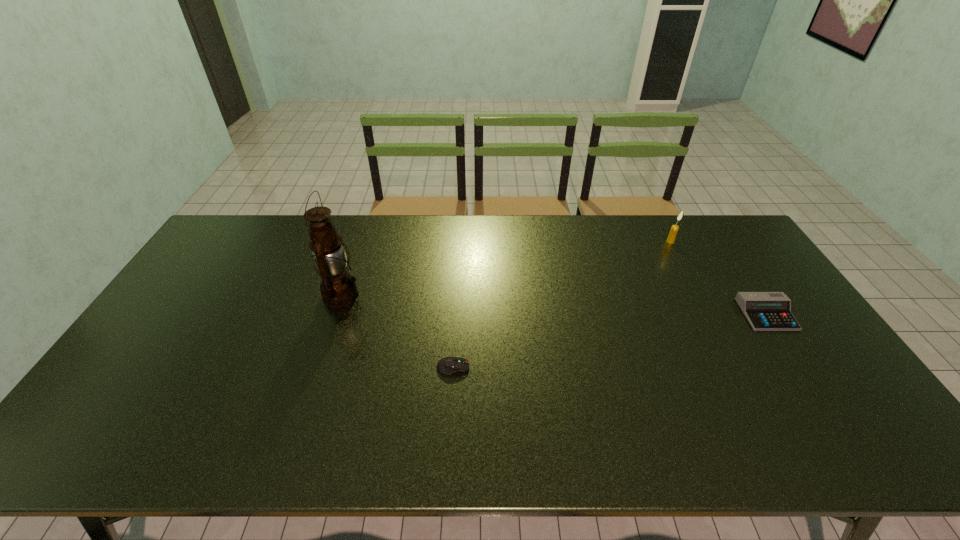
Where is `the tallest object`? The image size is (960, 540). the tallest object is located at coordinates (338, 288).

This screenshot has height=540, width=960. Find the location of `oil lamp`. oil lamp is located at coordinates (338, 288).

Identify the location of the farthest object. (674, 229).

Identify the location of the second tallest object. (674, 229).

You are a GUI agent. You are given a task and a screenshot of the screen. Output one action in this format:
    pyautogui.click(x=<x>, y=<y>)
    Task: Click on the third tallest object
    The height and width of the screenshot is (540, 960).
    Given the screenshot: What is the action you would take?
    pyautogui.click(x=765, y=311)

Image resolution: width=960 pixels, height=540 pixels. I want to click on calculator, so click(765, 311).

Where is `computer equipment`? computer equipment is located at coordinates (451, 364).

This screenshot has width=960, height=540. In order to click on the third object from right to left in this screenshot , I will do `click(451, 364)`.

The height and width of the screenshot is (540, 960). Identify the location of vacant area situated on the left of the oil lamp. (201, 295).

Locate an element on the screen. The width and height of the screenshot is (960, 540). free space located on the left of the second object from right to left is located at coordinates (625, 242).